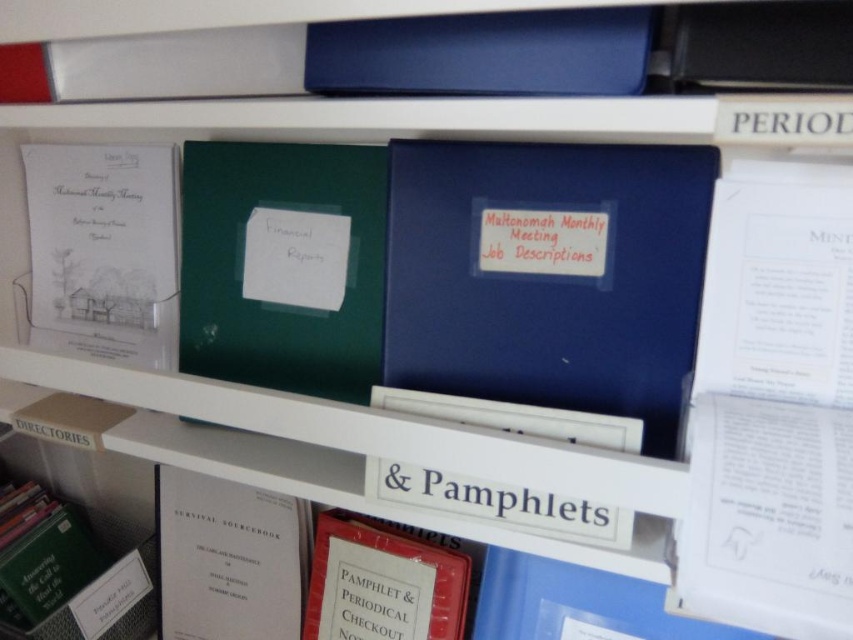
Which is behind, point (148, 147) or point (364, 573)?

Point (148, 147)

Is white paper drawing at left thinner than matte red book at center?

No, white paper drawing at left is not thinner than matte red book at center.

Does point (55, 211) come farther from viewer compared to point (387, 566)?

That is True.

Find the location of a particular element. The image size is (853, 640). white paper drawing at left is located at coordinates (103, 250).

Is white paper book at center positioned at the back of matte red book at center?

Yes, white paper book at center is further from the viewer.

Between white paper book at center and matte red book at center, which one has less height?

With less height is matte red book at center.

Is point (202, 602) closer to camera compared to point (318, 573)?

No, it is not.

In order to click on white paper book at center in this screenshot , I will do `click(228, 557)`.

Which is in front, point (279, 628) or point (306, 227)?

Positioned in front is point (306, 227).

Between white paper book at center and white paper at center, which one has more height?

white paper book at center is taller.

Measure the distance between point [267,538] and camera.

A distance of 35.79 inches exists between point [267,538] and camera.

Identify the location of white paper book at center. (228, 557).